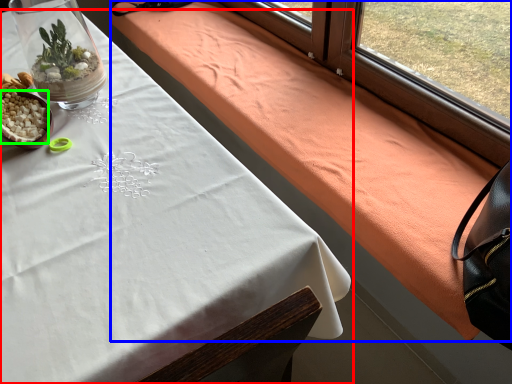
Question: Which object is the closest to the table (highlighted by a red box)? Choose among these: blanket (highlighted by a blue box) or food (highlighted by a green box).

Choices:
 (A) blanket
 (B) food

Answer: (B)